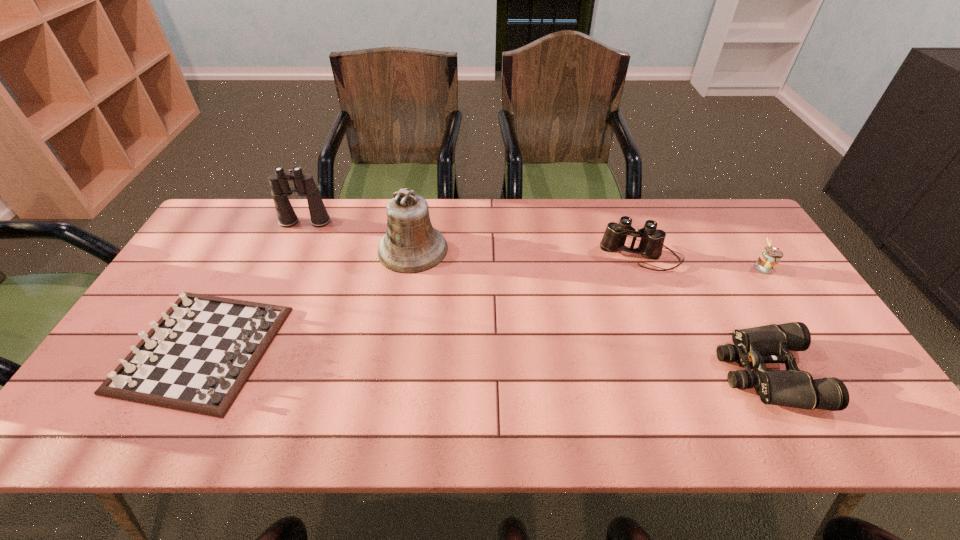
Find the location of `bell`. bell is located at coordinates (411, 245).

Where is `the farthest binoculars`? Image resolution: width=960 pixels, height=540 pixels. the farthest binoculars is located at coordinates (280, 189).

The image size is (960, 540). In order to click on the tallest binoculars in this screenshot , I will do `click(280, 189)`.

Find the location of a particular element. The height and width of the screenshot is (540, 960). the third tallest object is located at coordinates (651, 244).

Find the location of a particular element. This screenshot has height=540, width=960. the second farthest binoculars is located at coordinates (651, 244).

This screenshot has width=960, height=540. Identify the location of the rightmost object. coord(769,258).

The height and width of the screenshot is (540, 960). In order to click on the fourth tallest object in this screenshot , I will do `click(769, 258)`.

This screenshot has width=960, height=540. In order to click on the shortest binoculars in this screenshot , I will do `click(753, 347)`.

Identify the location of chessboard. (197, 358).

I want to click on vacant area situated on the left of the fourth object from right to left, so click(x=346, y=249).